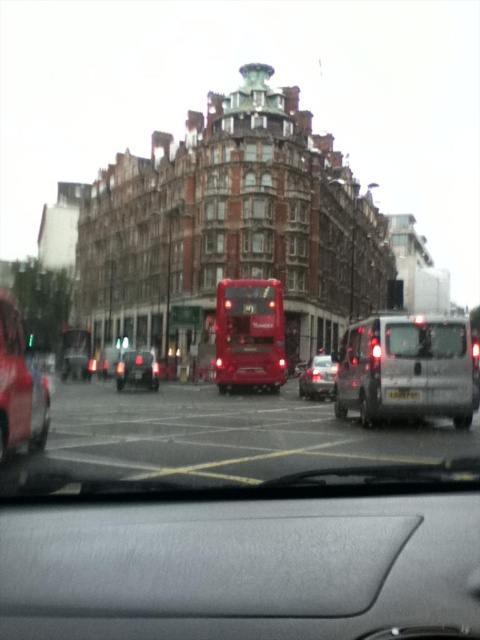
Question: Which of the following is the farthest from the observer?

Choices:
 (A) shiny black car at center
 (B) shiny silver car at center
 (C) silver metallic van at right

Answer: (A)

Question: Does shiny red bus at center come behind black plastic license plate at center?

Choices:
 (A) yes
 (B) no

Answer: (B)

Question: Where is shiny red bus at center located in relation to transparent glass windshield at center in the image?

Choices:
 (A) left
 (B) right

Answer: (A)

Question: Considering the real-world distances, which object is farthest from the shiny black car at center?

Choices:
 (A) black plastic license plate at center
 (B) shiny red bus at center
 (C) metallic red car at left
 (D) white plastic license plate at center

Answer: (C)

Question: Does silver metallic van at right have a lesser width compared to metallic red car at left?

Choices:
 (A) yes
 (B) no

Answer: (B)

Question: Which point is closer to the camera taking this photo?

Choices:
 (A) (222, 356)
 (B) (237, 369)
 (C) (46, 417)
 (D) (157, 380)

Answer: (C)